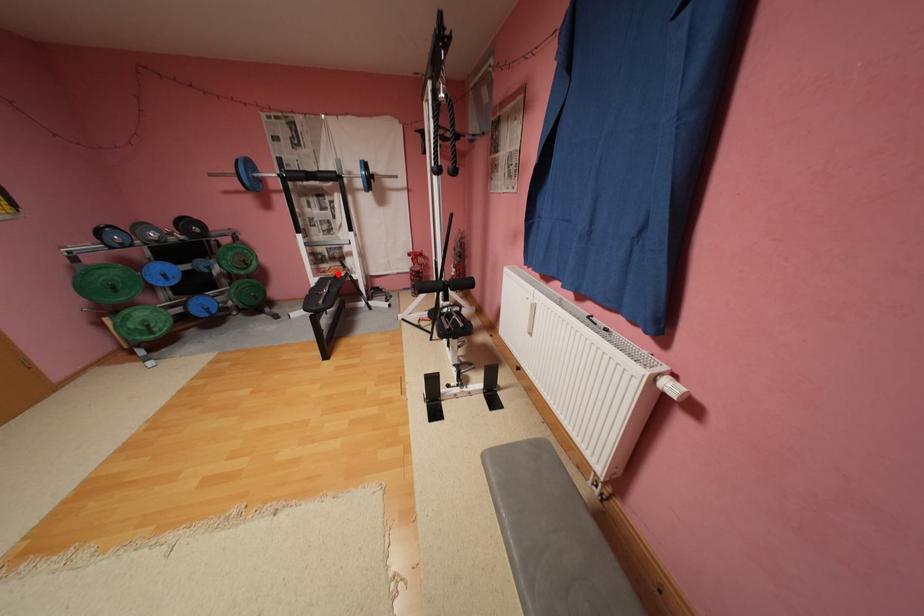
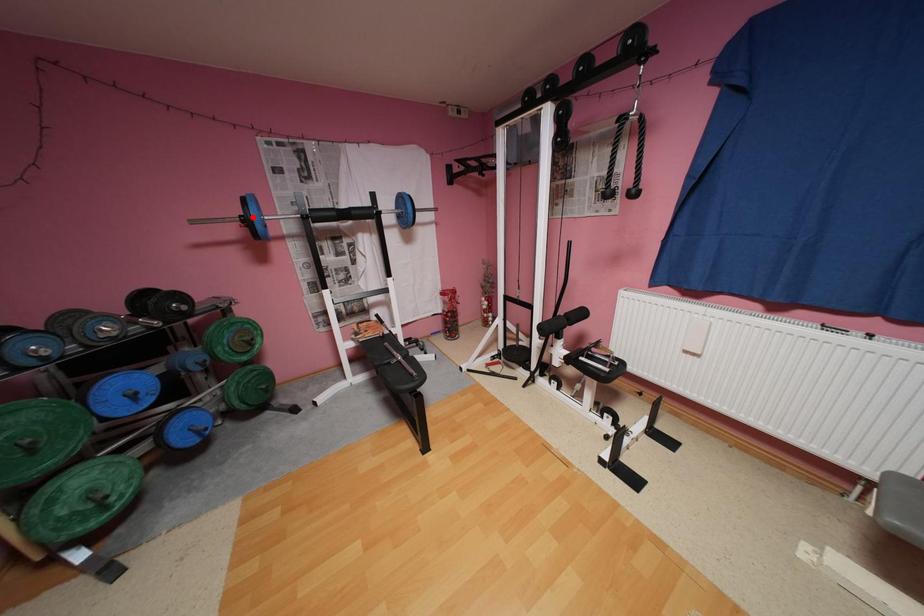
From the picture: I am providing you with two images of the same scene from different viewpoints. A red point is marked on the first image and another point is marked on the second image. Are the points marked in image1 and image2 representing the same 3D position?

No